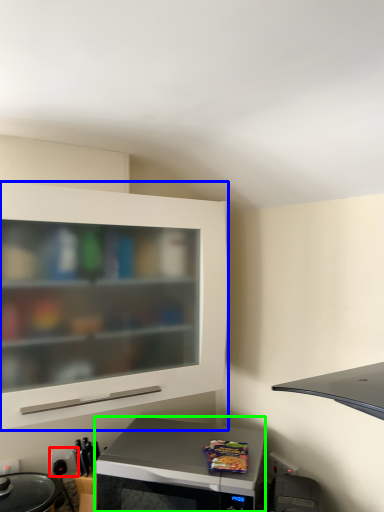
Question: Which is farther away from electric outlet (highlighted by a red box)? cabinetry (highlighted by a blue box) or microwave oven (highlighted by a green box)?

Choices:
 (A) cabinetry
 (B) microwave oven

Answer: (A)